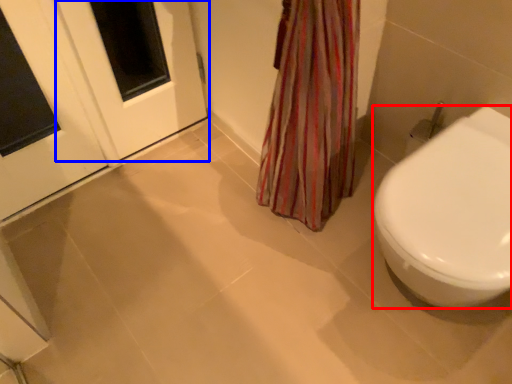
Question: Among these objects, which one is nearest to the camera, bidet (highlighted by a red box) or screen door (highlighted by a blue box)?

Choices:
 (A) bidet
 (B) screen door

Answer: (A)